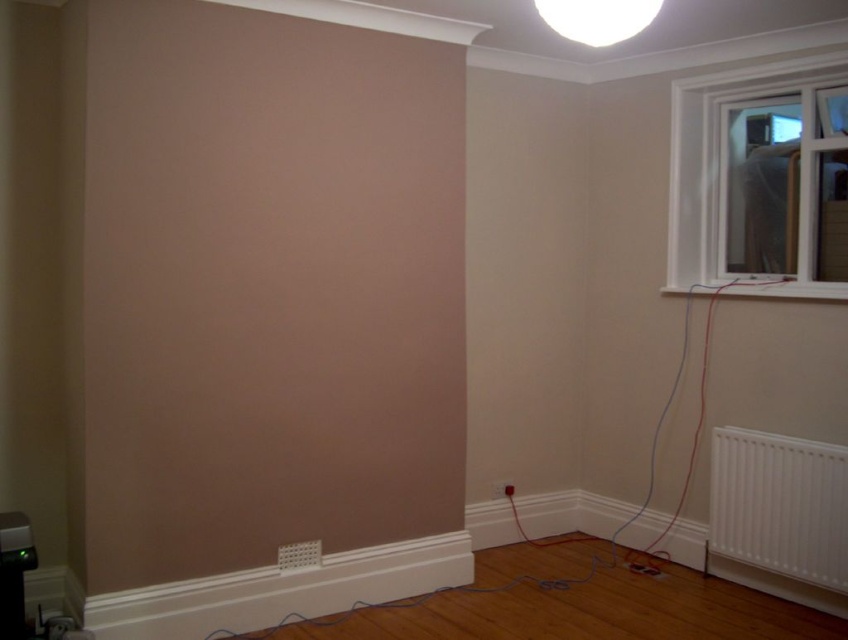
Does white plastic radiator at lower right have a greater width compared to white plastic window at upper right?

Incorrect, white plastic radiator at lower right's width does not surpass white plastic window at upper right's.

Between point (830, 570) and point (701, 224), which one is positioned behind?

The point (701, 224) is more distant.

Which is in front, point (726, 445) or point (713, 172)?

Point (726, 445) is more forward.

This screenshot has width=848, height=640. Find the location of `white plastic radiator at lower right`. white plastic radiator at lower right is located at coordinates (779, 506).

Does white plastic window at upper right have a greater height compared to white glossy ceiling light at upper center?

Indeed, white plastic window at upper right has a greater height compared to white glossy ceiling light at upper center.

Does white plastic window at upper right appear under white glossy ceiling light at upper center?

Yes, white plastic window at upper right is below white glossy ceiling light at upper center.

Is point (816, 292) in front of point (595, 13)?

That is False.

Where is `white plastic window at upper right`? white plastic window at upper right is located at coordinates (717, 154).

Is white plastic radiator at lower right closer to the viewer compared to white glossy ceiling light at upper center?

No, white plastic radiator at lower right is further to the viewer.

Identify the location of white plastic radiator at lower right. (779, 506).

This screenshot has height=640, width=848. What do you see at coordinates (779, 506) in the screenshot?
I see `white plastic radiator at lower right` at bounding box center [779, 506].

You are a GUI agent. You are given a task and a screenshot of the screen. Output one action in this format:
    pyautogui.click(x=<x>, y=<y>)
    Task: Click on the white plastic radiator at lower right
    The image size is (848, 640).
    Given the screenshot: What is the action you would take?
    pyautogui.click(x=779, y=506)